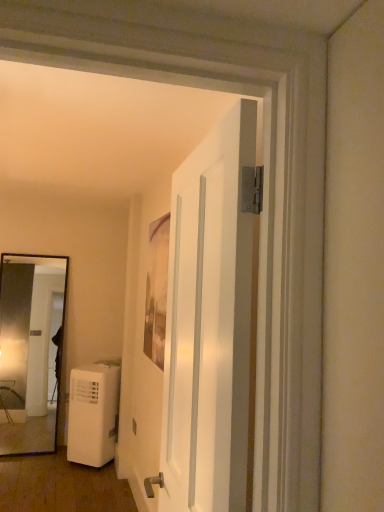
Question: Considering the positions of white matte door at center and white matte air purifier at lower left in the image, is white matte door at center taller or shorter than white matte air purifier at lower left?

Choices:
 (A) tall
 (B) short

Answer: (A)

Question: Considering the positions of white matte door at center and white matte air purifier at lower left in the image, is white matte door at center bigger or smaller than white matte air purifier at lower left?

Choices:
 (A) small
 (B) big

Answer: (B)

Question: Which object is the closest to the white plastic air conditioner at lower left?

Choices:
 (A) white matte door at center
 (B) white matte air purifier at lower left

Answer: (B)

Question: Considering the real-world distances, which object is closest to the white matte door at center?

Choices:
 (A) white plastic air conditioner at lower left
 (B) white matte air purifier at lower left

Answer: (B)